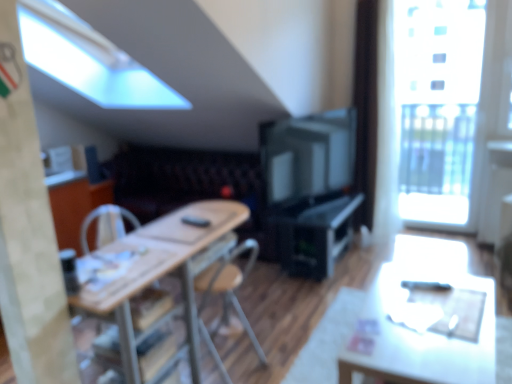
The height and width of the screenshot is (384, 512). What do you see at coordinates (154, 274) in the screenshot?
I see `wooden chair at center, which is counted as the first chair, starting from the front` at bounding box center [154, 274].

The width and height of the screenshot is (512, 384). I want to click on transparent glass window at upper right, so click(x=438, y=107).

I want to click on matte black television at center, so click(308, 154).

The height and width of the screenshot is (384, 512). Identify the location of matte white table at lower right. (425, 332).

Where is `velvet dark brown couch at center`? The image size is (512, 384). velvet dark brown couch at center is located at coordinates (185, 181).

What do you see at coordinates (227, 296) in the screenshot?
I see `wooden at left, the second chair in the front-to-back sequence` at bounding box center [227, 296].

Where is `wooden chair at center, which is counted as the first chair, starting from the front`? Image resolution: width=512 pixels, height=384 pixels. wooden chair at center, which is counted as the first chair, starting from the front is located at coordinates (154, 274).

Locate an element on the screen. The image size is (512, 384). chair that is below the wooden at left, the second chair in the front-to-back sequence (from the image's perspective) is located at coordinates (154, 274).

Which is more to the left, wooden at left, the second chair in the front-to-back sequence, or wooden chair at center, which appears as the 2th chair when viewed from the back?

From the viewer's perspective, wooden chair at center, which appears as the 2th chair when viewed from the back, appears more on the left side.

Is wooden at left, the second chair in the front-to-back sequence, inside or outside of wooden chair at center, which appears as the 2th chair when viewed from the back?

wooden at left, the second chair in the front-to-back sequence, is contained in wooden chair at center, which appears as the 2th chair when viewed from the back.

From the image's perspective, which object appears higher, wooden at left, arranged as the first chair when viewed from the back, or wooden chair at center, which appears as the 2th chair when viewed from the back?

wooden at left, arranged as the first chair when viewed from the back, is shown above in the image.

Based on the photo, from the image's perspective, is wooden chair at center, which appears as the 2th chair when viewed from the back, located above or below velvet dark brown couch at center?

From the image's perspective, wooden chair at center, which appears as the 2th chair when viewed from the back, appears below velvet dark brown couch at center.

Does point (193, 350) come behind point (207, 196)?

No, (193, 350) is closer to viewer.

Can you confirm if wooden chair at center, which appears as the 2th chair when viewed from the back, is positioned to the right of velvet dark brown couch at center?

Correct, you'll find wooden chair at center, which appears as the 2th chair when viewed from the back, to the right of velvet dark brown couch at center.

From a real-world perspective, who is located higher, wooden chair at center, which is counted as the first chair, starting from the front, or velvet dark brown couch at center?

In real-world perspective, wooden chair at center, which is counted as the first chair, starting from the front, is above.

Considering the points (324, 245) and (183, 232), which point is in front, point (324, 245) or point (183, 232)?

The point (183, 232) is in front.

Based on their positions, is black plastic computer desk at center located to the left or right of wooden table at center?

black plastic computer desk at center is positioned on wooden table at center's right side.

In the image, is black plastic computer desk at center positioned in front of or behind wooden table at center?

black plastic computer desk at center is positioned farther from the viewer than wooden table at center.

Relative to transparent glass window at upper right, is white fabric armchair at center in front or behind?

→ Visually, white fabric armchair at center is located in front of transparent glass window at upper right.

Is white fabric armchair at center placed right next to transparent glass window at upper right?

There is a gap between white fabric armchair at center and transparent glass window at upper right.

Which is behind, black plastic remote control at center or transparent glass window at upper right?

transparent glass window at upper right is further away from the camera.

Based on their positions, is black plastic remote control at center located to the left or right of transparent glass window at upper right?

In the image, black plastic remote control at center appears on the left side of transparent glass window at upper right.

At what (x,y) coordinates should I click in order to perform the action: click on remote control below the transparent glass window at upper right (from a real-world perspective). Please return your answer as a coordinate pair (x, y). Looking at the image, I should click on (196, 221).

Is black plastic remote control at center next to transparent glass window at upper right and touching it?

black plastic remote control at center is not next to transparent glass window at upper right, and they're not touching.

Is white fabric armchair at center facing towards matte white table at lower right?

No, white fabric armchair at center is not aimed at matte white table at lower right.

From the picture: Is white fabric armchair at center placed right next to matte white table at lower right?

white fabric armchair at center and matte white table at lower right are not in contact.

From the image's perspective, is white fabric armchair at center above matte white table at lower right?

Yes.

Looking at their sizes, would you say white fabric armchair at center is wider or thinner than matte white table at lower right?

Clearly, white fabric armchair at center has less width compared to matte white table at lower right.

In terms of width, does matte black television at center look wider or thinner when compared to wooden table at center?

Clearly, matte black television at center has less width compared to wooden table at center.

What's the angular difference between matte black television at center and wooden table at center's facing directions?

They differ by 22.7 degrees in their facing directions.

From a real-world perspective, is matte black television at center over wooden table at center?

Correct, in the physical world, matte black television at center is higher than wooden table at center.

How much distance is there between matte black television at center and wooden table at center?

matte black television at center and wooden table at center are 3.92 feet apart from each other.

Find the location of a particular element. chair lying in front of the wooden at left, the second chair in the front-to-back sequence is located at coordinates (154, 274).

At what (x,y) coordinates should I click in order to perform the action: click on chair that is the 2nd one when counting downward from the velvet dark brown couch at center (from the image's perspective). Please return your answer as a coordinate pair (x, y). Looking at the image, I should click on (154, 274).

Considering their positions, is transparent glass window at upper right positioned closer to matte white table at lower right than matte black television at center?

Based on the image, transparent glass window at upper right appears to be nearer to matte white table at lower right.

Which object lies further to the anchor point wooden table at center, matte black television at center or wooden chair at center, which appears as the 2th chair when viewed from the back?

matte black television at center is further to wooden table at center.

From the image, which object appears to be farther from wooden table at center, white fabric armchair at center or wooden chair at center, which is counted as the first chair, starting from the front?

white fabric armchair at center.

Considering their positions, is white fabric armchair at center positioned closer to black plastic remote control at center than wooden table at center?

wooden table at center.

Based on their spatial positions, is matte white table at lower right or white fabric armchair at center further from black plastic computer desk at center?

white fabric armchair at center is positioned further to the anchor black plastic computer desk at center.

Looking at the image, which one is located further to transparent glass window at upper right, black plastic remote control at center or wooden at left, arranged as the first chair when viewed from the back?

black plastic remote control at center is positioned further to the anchor transparent glass window at upper right.

Which object lies nearer to the anchor point white fabric armchair at center, wooden table at center or matte black television at center?

The object closer to white fabric armchair at center is wooden table at center.

Based on their spatial positions, is matte white table at lower right or black plastic remote control at center further from wooden table at center?

Based on the image, matte white table at lower right appears to be further to wooden table at center.

The height and width of the screenshot is (384, 512). Identify the location of couch located between matte white table at lower right and transparent glass window at upper right in the depth direction. point(185,181).

Locate an element on the screen. The image size is (512, 384). table top between wooden at left, the second chair in the front-to-back sequence, and velvet dark brown couch at center in the front-back direction is located at coordinates [196, 218].

What are the coordinates of `table top located between matte white table at lower right and transparent glass window at upper right in the depth direction` in the screenshot? It's located at (196, 218).

This screenshot has width=512, height=384. In order to click on table top between matte white table at lower right and velvet dark brown couch at center from front to back in this screenshot , I will do `click(196, 218)`.